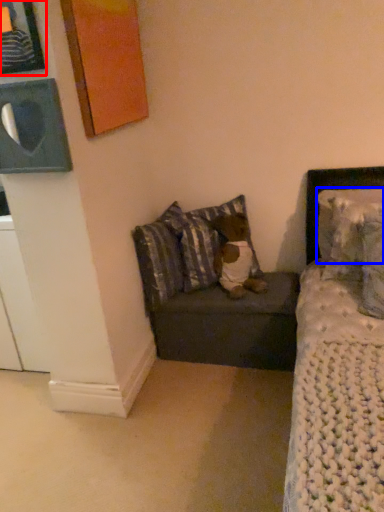
Question: Which object appears farthest to the camera in this image, picture frame (highlighted by a red box) or pillow (highlighted by a blue box)?

Choices:
 (A) picture frame
 (B) pillow

Answer: (B)